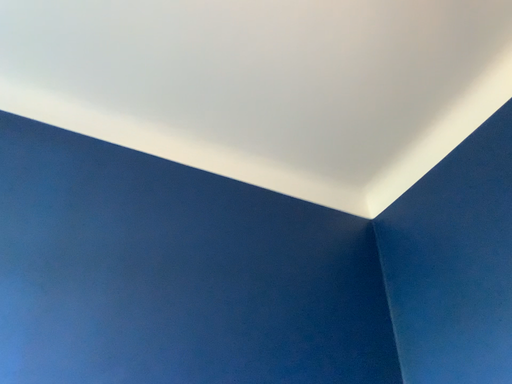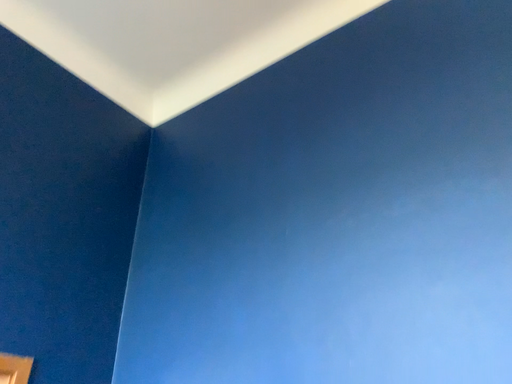
Question: Which way did the camera rotate in the video?

Choices:
 (A) rotated left
 (B) rotated right

Answer: (B)